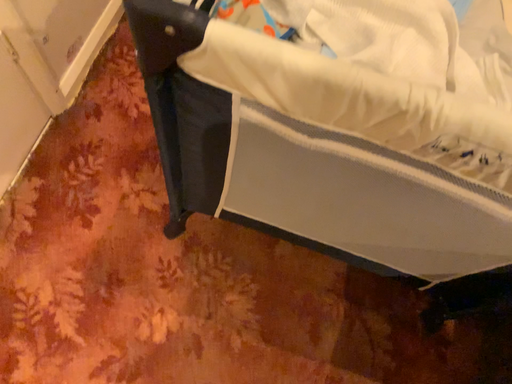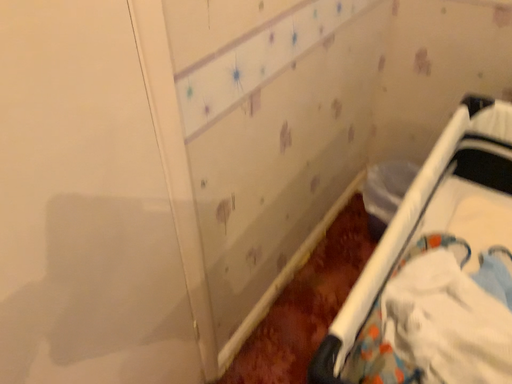
Question: How did the camera likely rotate when shooting the video?

Choices:
 (A) rotated upward
 (B) rotated downward

Answer: (A)